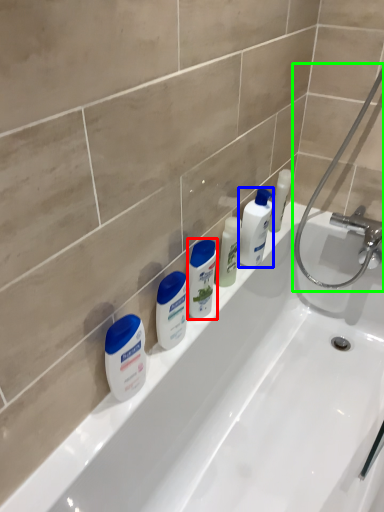
Question: Estimate the real-world distances between objects in this image. Which object is closer to toiletry (highlighted by a red box), toiletry (highlighted by a blue box) or shower (highlighted by a green box)?

Choices:
 (A) toiletry
 (B) shower

Answer: (A)